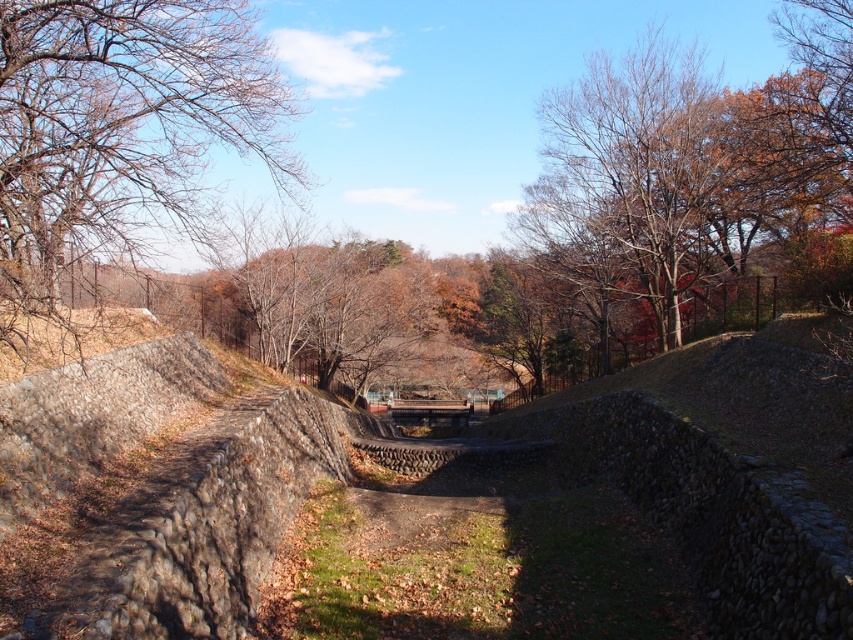
Question: Which object is closer to the camera taking this photo?

Choices:
 (A) bare branches at upper left
 (B) rough stone mound at center

Answer: (B)

Question: Is bare branches at upper left behind rough stone mound at center?

Choices:
 (A) yes
 (B) no

Answer: (A)

Question: Which object is closer to the camera taking this photo?

Choices:
 (A) rough stone mound at center
 (B) bare branches at upper left

Answer: (A)

Question: Where is bare branches at upper left located in relation to rough stone mound at center in the image?

Choices:
 (A) left
 (B) right

Answer: (A)

Question: Is bare branches at upper left positioned in front of rough stone mound at center?

Choices:
 (A) yes
 (B) no

Answer: (B)